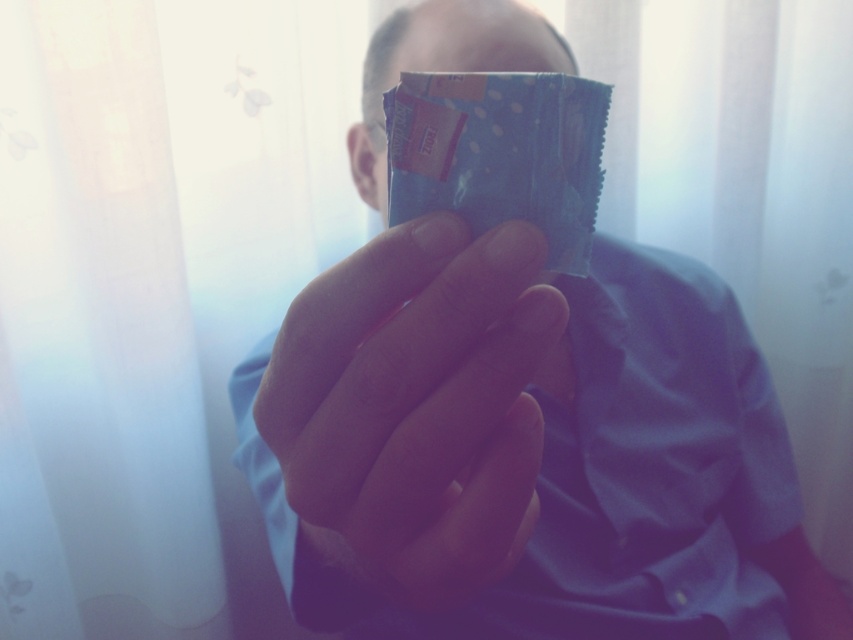
Question: Among these objects, which one is nearest to the camera?

Choices:
 (A) matte plastic hand at center
 (B) blue matte chocolate bar at center

Answer: (A)

Question: Does matte plastic packet at center appear under blue matte chocolate bar at center?

Choices:
 (A) no
 (B) yes

Answer: (B)

Question: Does matte plastic packet at center come behind matte plastic hand at center?

Choices:
 (A) no
 (B) yes

Answer: (B)

Question: Which point is farther from the camera taking this photo?

Choices:
 (A) (444, 476)
 (B) (428, 81)
 (C) (570, 353)

Answer: (C)

Question: Where is matte plastic packet at center located in relation to blue matte chocolate bar at center in the image?

Choices:
 (A) right
 (B) left

Answer: (A)

Question: Which object is closer to the camera taking this photo?

Choices:
 (A) matte plastic hand at center
 (B) blue matte chocolate bar at center

Answer: (A)